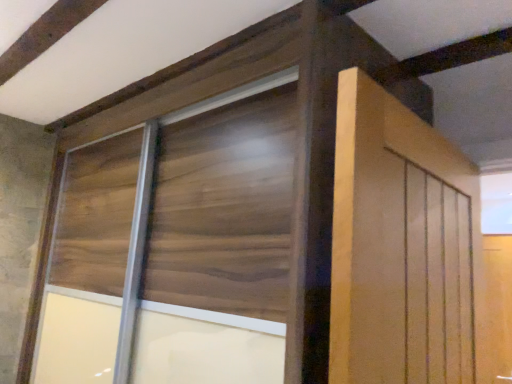
Identify the location of satin wood window frame at center. This screenshot has height=384, width=512. (178, 247).

What do you see at coordinates (178, 247) in the screenshot? This screenshot has height=384, width=512. I see `satin wood window frame at center` at bounding box center [178, 247].

In order to click on satin wood window frame at center in this screenshot , I will do `click(178, 247)`.